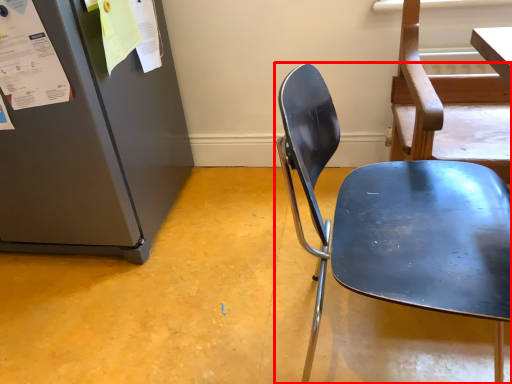
Question: Considering the relative positions of chair (annotated by the red box) and paper in the image provided, where is chair (annotated by the red box) located with respect to the staircase?

Choices:
 (A) left
 (B) right

Answer: (B)